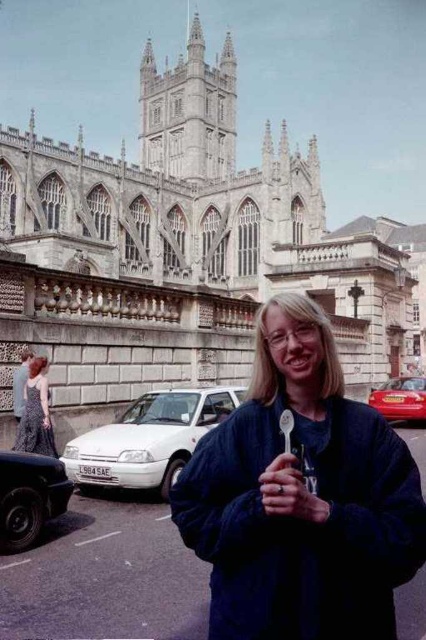
Who is positioned more to the right, blue fabric spoon at center or patterned fabric dress at left?

blue fabric spoon at center is more to the right.

Between blue fabric spoon at center and patterned fabric dress at left, which one is positioned lower?

patterned fabric dress at left

Between point (224, 579) and point (36, 384), which one is positioned behind?

The point (36, 384) is behind.

The width and height of the screenshot is (426, 640). I want to click on blue fabric spoon at center, so click(x=302, y=497).

Does patterned fabric dress at left have a lesser width compared to shiny red car at center right?

Indeed, patterned fabric dress at left has a lesser width compared to shiny red car at center right.

Does patterned fabric dress at left appear on the left side of shiny red car at center right?

Indeed, patterned fabric dress at left is positioned on the left side of shiny red car at center right.

The image size is (426, 640). Describe the element at coordinates (36, 412) in the screenshot. I see `patterned fabric dress at left` at that location.

The image size is (426, 640). I want to click on patterned fabric dress at left, so click(x=36, y=412).

From the picture: Does white matte car at lower left appear on the right side of patterned fabric dress at left?

Correct, you'll find white matte car at lower left to the right of patterned fabric dress at left.

Does white matte car at lower left lie behind patterned fabric dress at left?

No, it is in front of patterned fabric dress at left.

Who is more forward, (x=164, y=429) or (x=32, y=381)?

Point (x=164, y=429) is more forward.

Identify the location of white matte car at lower left. Image resolution: width=426 pixels, height=640 pixels. (149, 440).